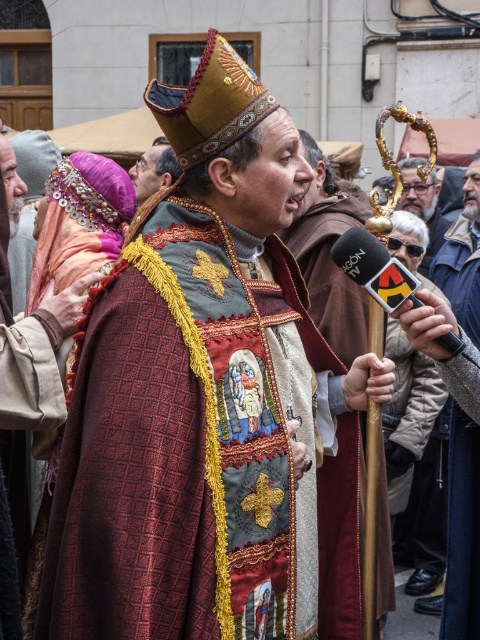
Who is more forward, (444, 609) or (383, 266)?

Point (383, 266) is more forward.

Between velvet brown robe at center and black plastic microphone at center, which one has less height?

black plastic microphone at center

The width and height of the screenshot is (480, 640). Find the location of `velvet brown robe at center`. velvet brown robe at center is located at coordinates (462, 529).

The width and height of the screenshot is (480, 640). In order to click on velvet brown robe at center in this screenshot , I will do `click(462, 529)`.

This screenshot has height=640, width=480. Describe the element at coordinates (374, 268) in the screenshot. I see `black plastic microphone at center` at that location.

Can you confirm if black plastic microphone at center is taller than matte black microphone at center?

No, black plastic microphone at center is not taller than matte black microphone at center.

Who is more forward, (376, 276) or (408, 164)?

Point (376, 276) is more forward.

The height and width of the screenshot is (640, 480). I want to click on black plastic microphone at center, so click(374, 268).

Does velvet brown robe at center lie behind matte black microphone at center?

No, it is not.

At what (x,y) coordinates should I click in order to perform the action: click on velvet brown robe at center. Please return your answer as a coordinate pair (x, y). The height and width of the screenshot is (640, 480). Looking at the image, I should click on (462, 529).

Locate an element on the screen. This screenshot has height=640, width=480. velvet brown robe at center is located at coordinates (462, 529).